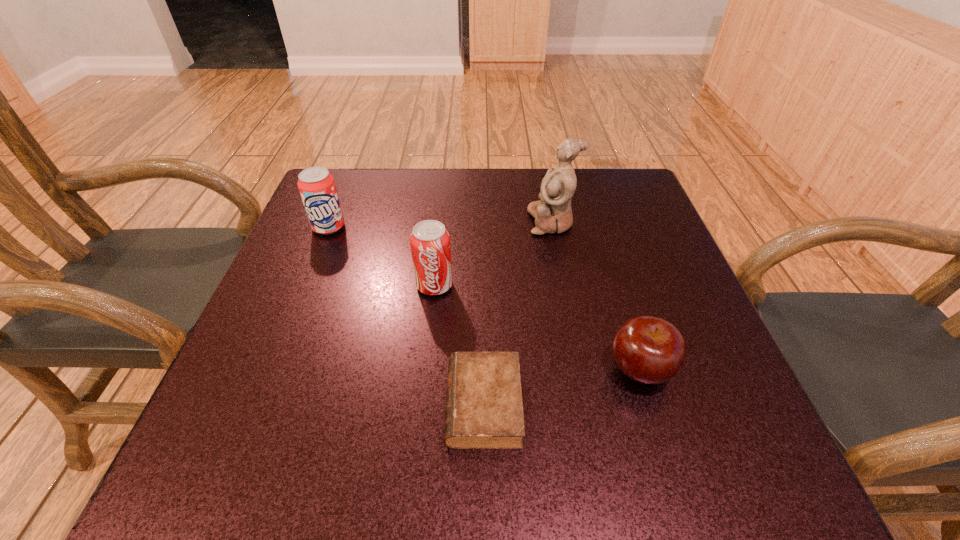
I want to click on blank space located on the front-facing side of the tallest object, so click(x=373, y=222).

Find the location of a particular element. Image resolution: width=960 pixels, height=540 pixels. vacant space situated 0.280m on the logo side of the third nearest object is located at coordinates 419,432.

Where is `free space located on the surface of the left soda can`? free space located on the surface of the left soda can is located at coordinates (295, 312).

You are a GUI agent. You are given a task and a screenshot of the screen. Output one action in this format:
    pyautogui.click(x=<x>, y=<y>)
    Task: Click on the vacant space located on the front of the fourth tallest object
    
    Given the screenshot: What is the action you would take?
    pyautogui.click(x=672, y=473)

This screenshot has width=960, height=540. Identify the location of vacant space located on the spine side of the diary. (229, 404).

At what (x,y) coordinates should I click in order to perform the action: click on free space located 0.140m on the spine side of the diary. Please return your answer as a coordinate pair (x, y). The width and height of the screenshot is (960, 540). Looking at the image, I should click on (360, 404).

The height and width of the screenshot is (540, 960). I want to click on blank space located on the spine side of the diary, so click(323, 404).

Locate an element on the screen. figurine situated at the far edge is located at coordinates (552, 213).

Find the location of a particular element. The image size is (960, 540). soda can situated at the far edge is located at coordinates (317, 187).

What are the coordinates of `object that is at the near edge` in the screenshot? It's located at (484, 410).